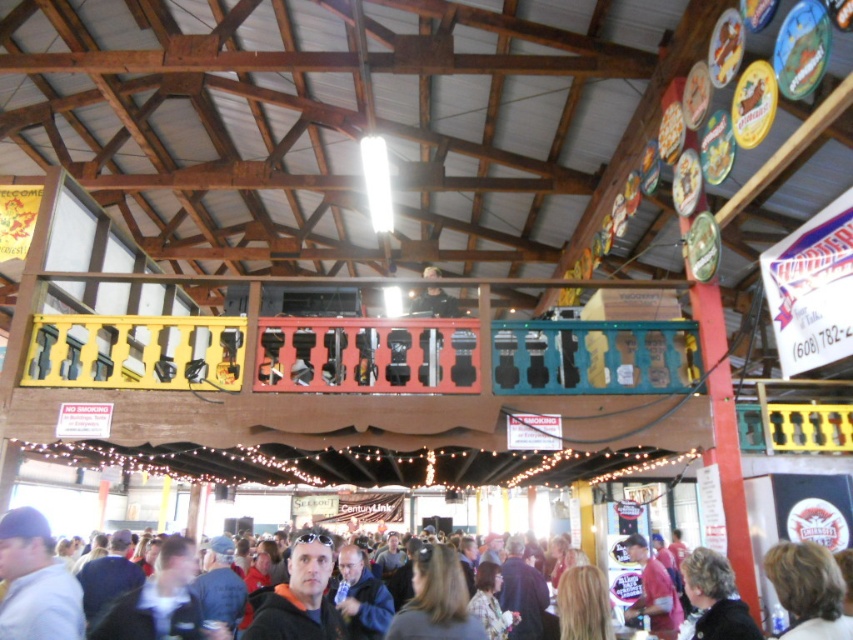
Does dark blue jacket at center appear under light blue baseball cap at lower left?

Yes, dark blue jacket at center is below light blue baseball cap at lower left.

What do you see at coordinates (35, 582) in the screenshot? The image size is (853, 640). I see `dark blue jacket at center` at bounding box center [35, 582].

Locate an element on the screen. This screenshot has width=853, height=640. dark blue jacket at center is located at coordinates (35, 582).